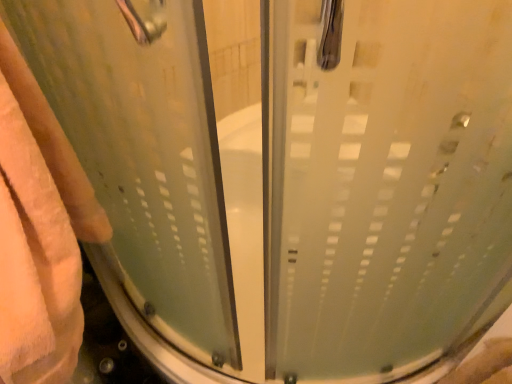
Question: Would you say frosted glass shower door at center, placed as the 1th screen door when sorted from right to left, is inside or outside beige fluffy towel at left?

Choices:
 (A) inside
 (B) outside

Answer: (B)

Question: Considering the positions of point (292, 157) and point (12, 367), is point (292, 157) closer or farther from the camera than point (12, 367)?

Choices:
 (A) farther
 (B) closer

Answer: (B)

Question: Based on their relative distances, which object is nearer to the frosted glass shower door at center, placed as the 1th screen door when sorted from right to left?

Choices:
 (A) frosted glass shower door at center, placed as the 2th screen door when sorted from right to left
 (B) beige fluffy towel at left

Answer: (A)

Question: Which object is positioned closest to the frosted glass shower door at center, placed as the 1th screen door when sorted from right to left?

Choices:
 (A) frosted glass shower door at center, placed as the 2th screen door when sorted from right to left
 (B) beige fluffy towel at left

Answer: (A)